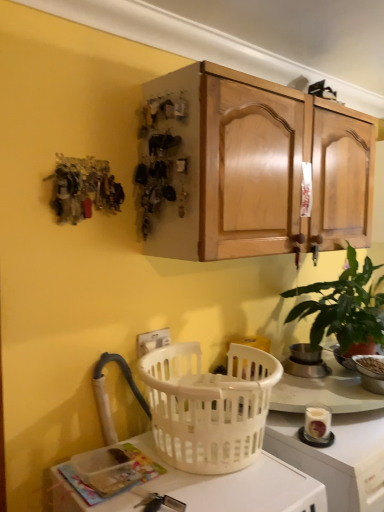
Question: Does white plastic electric outlet at lower center have a larger size compared to white plastic bowl at lower right, positioned as the 1th appliance in right-to-left order?

Choices:
 (A) no
 (B) yes

Answer: (A)

Question: Is white plastic electric outlet at lower center smaller than white plastic bowl at lower right, positioned as the 1th appliance in right-to-left order?

Choices:
 (A) no
 (B) yes

Answer: (B)

Question: Considering the relative sizes of white plastic electric outlet at lower center and white plastic bowl at lower right, the second appliance positioned from the left, in the image provided, is white plastic electric outlet at lower center shorter than white plastic bowl at lower right, the second appliance positioned from the left,?

Choices:
 (A) no
 (B) yes

Answer: (A)

Question: Can you confirm if white plastic electric outlet at lower center is taller than white plastic bowl at lower right, positioned as the 1th appliance in right-to-left order?

Choices:
 (A) yes
 (B) no

Answer: (A)

Question: Does white plastic electric outlet at lower center contain white plastic bowl at lower right, positioned as the 1th appliance in right-to-left order?

Choices:
 (A) yes
 (B) no

Answer: (B)

Question: Is white plastic electric outlet at lower center thinner than white plastic bowl at lower right, the second appliance positioned from the left?

Choices:
 (A) no
 (B) yes

Answer: (B)

Question: Does white plastic electric outlet at lower center appear on the right side of white plastic basket at lower center?

Choices:
 (A) no
 (B) yes

Answer: (A)

Question: Is white plastic electric outlet at lower center to the left of white plastic basket at lower center from the viewer's perspective?

Choices:
 (A) yes
 (B) no

Answer: (A)

Question: Is white plastic electric outlet at lower center oriented towards white plastic basket at lower center?

Choices:
 (A) yes
 (B) no

Answer: (B)

Question: Are white plastic electric outlet at lower center and white plastic basket at lower center far apart?

Choices:
 (A) yes
 (B) no

Answer: (B)

Question: Does white plastic electric outlet at lower center have a lesser height compared to white plastic basket at lower center?

Choices:
 (A) no
 (B) yes

Answer: (B)

Question: Is white plastic electric outlet at lower center next to white plastic basket at lower center and touching it?

Choices:
 (A) no
 (B) yes

Answer: (A)

Question: Is green matte plant at right touching metallic silver pot at upper right, positioned as the first appliance in left-to-right order?

Choices:
 (A) yes
 (B) no

Answer: (B)